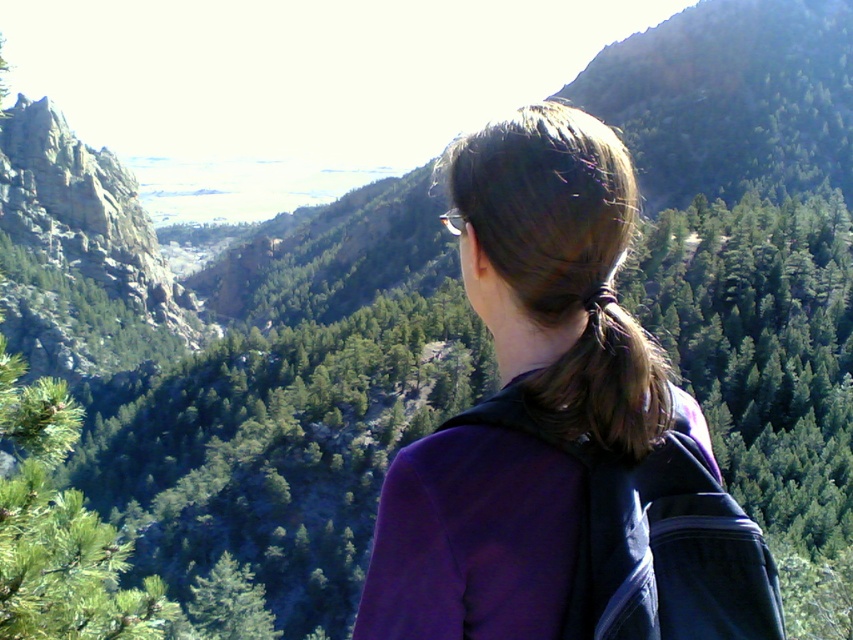
You are a hiker who has just arrived at the overlook. You notice a purple fabric at center in your field of view. If you want to reach it, which direction should you move relative to your current position?

The purple fabric at center is located at point coordinates of (560, 432). Since you are standing at the edge of the overlook, you would need to move forward towards the valley below to reach it.

Looking at this image, you are a photographer wanting to capture the person at the overlook. The person is wearing a purple jacket and has brown shiny hair. Where should you position your camera to ensure both the purple fabric at center and brown shiny hair at center are visible in the frame?

To capture both the purple fabric at center and brown shiny hair at center, position the camera so that the purple fabric at center is below the brown shiny hair at center in the frame, as the purple fabric at center is positioned under brown shiny hair at center.